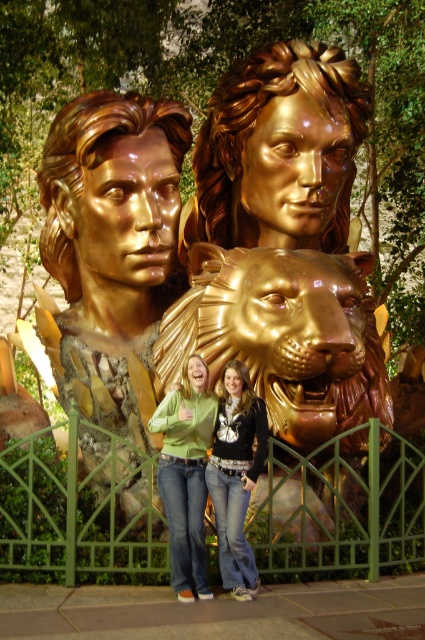
You are standing in front of the sculpture and notice the gold polished statue at center and the jeans at center. Which object is closer to your left side?

The gold polished statue at center is to the left of jeans at center, so it is closer to your left side.

You are a tour guide explaining the layout of the sculpture garden. Where is the gold polished statue at center located in terms of its 2D coordinates?

The gold polished statue at center is located at the 2D coordinates of point (231,259).